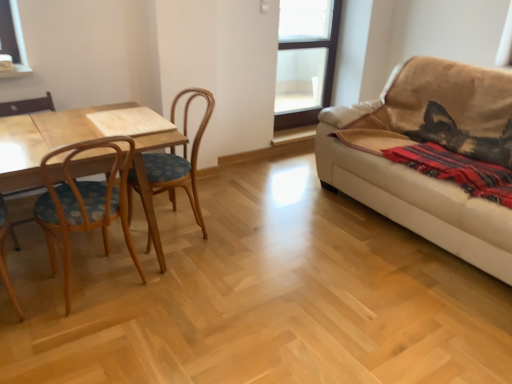
This screenshot has width=512, height=384. I want to click on vacant area that is in front of woodenchair at left, so click(x=197, y=274).